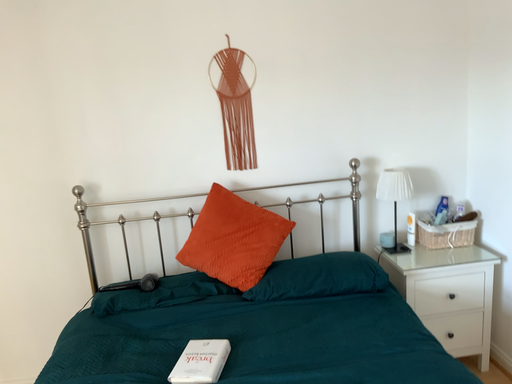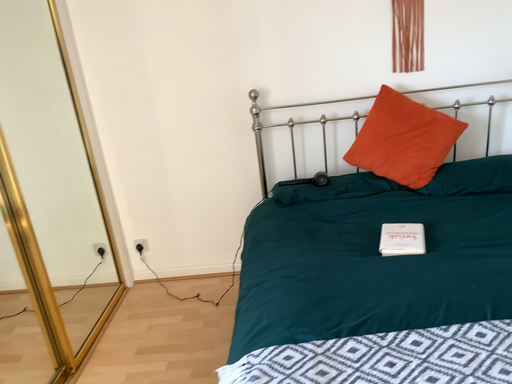
Question: Which way did the camera rotate in the video?

Choices:
 (A) rotated right
 (B) rotated left

Answer: (B)